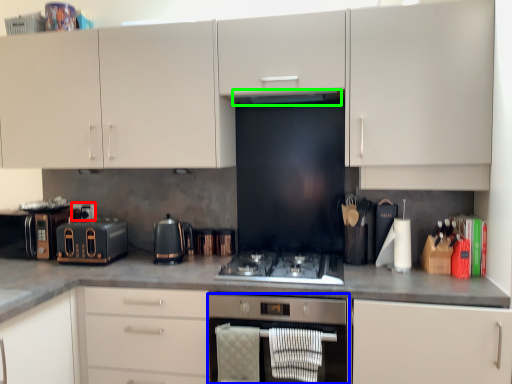
Question: Which object is the farthest from appliance (highlighted by a red box)? Choose among these: home appliance (highlighted by a blue box) or exhaust hood (highlighted by a green box).

Choices:
 (A) home appliance
 (B) exhaust hood

Answer: (A)